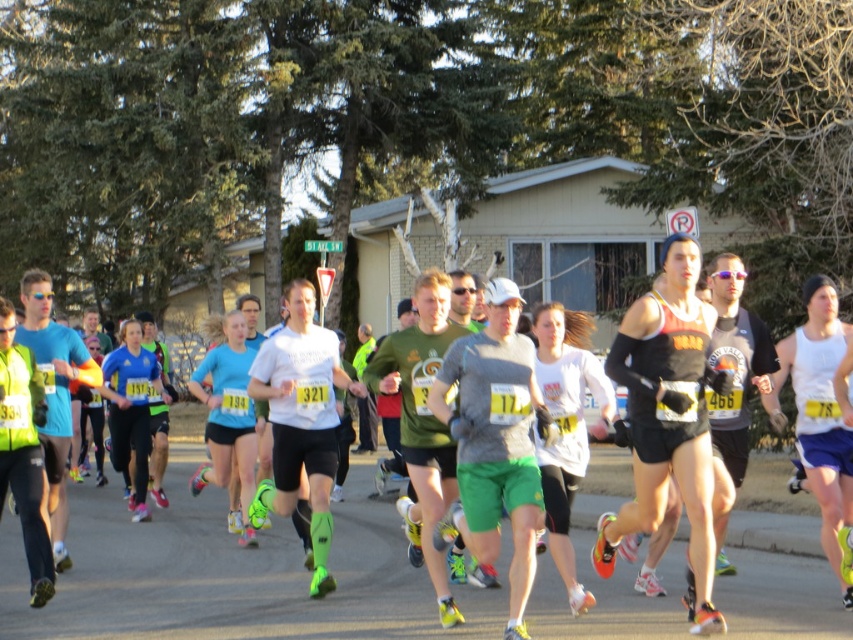
You are a photographer standing at the starting line of the marathon. You want to take a closeup shot of the gray matte shirt at center. Considering your camera can focus on objects within 5 meters, will you be able to capture a clear closeup?

The gray matte shirt at center is 7.62 meters away from the viewer, which is beyond the camera focus range of 5 meters. Therefore, you won

Looking at this image, you are a photographer positioned at the starting line of the marathon. You want to take a photo that clearly shows both the gray matte shirt at center and the white fabric tank top at center. Considering their positions, which runner will appear larger in your photo?

The gray matte shirt at center will appear larger in the photo because it is closer to the viewer than the white fabric tank top at center.

You are a photographer positioned at the starting line of the marathon, and you want to capture a photo of both the gray matte shirt at center and the white fabric tank top at center. Which runner should you focus on first to ensure both are in the frame?

The gray matte shirt at center is located below the white fabric tank top at center, so you should focus on the white fabric tank top at center first to ensure both are in the frame.